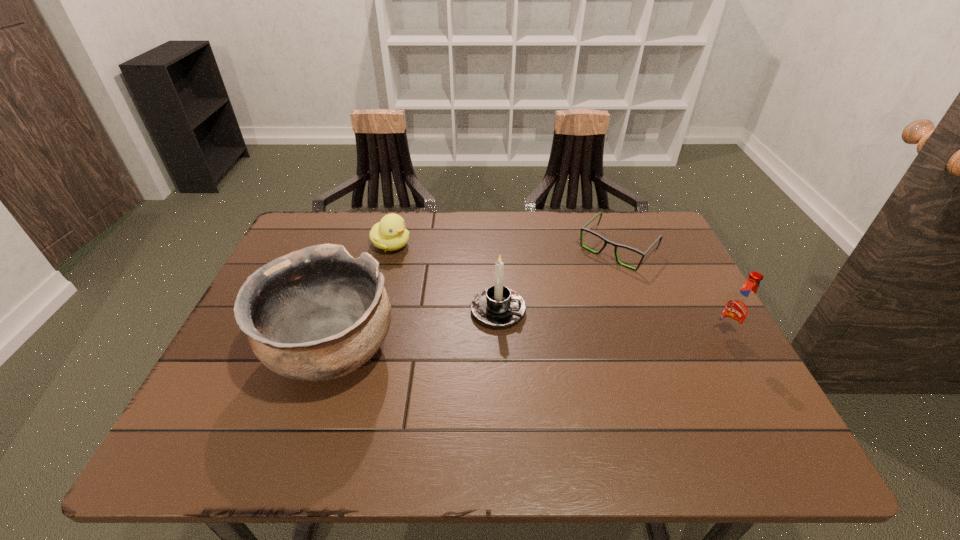
Locate an element on the screen. object present at the left edge is located at coordinates (316, 314).

Where is `root beer positioned at the right edge`? This screenshot has width=960, height=540. root beer positioned at the right edge is located at coordinates (738, 310).

In order to click on spectacles that is at the right edge in this screenshot , I will do `click(583, 228)`.

Locate an element on the screen. The height and width of the screenshot is (540, 960). object that is at the near left corner is located at coordinates (316, 314).

What are the coordinates of `object located at the far right corner` in the screenshot? It's located at (583, 228).

Find the location of a particular element. This screenshot has height=540, width=960. vacant region at the far edge is located at coordinates (591, 222).

Locate an element on the screen. This screenshot has height=540, width=960. free space at the near edge of the desktop is located at coordinates tap(612, 395).

In the image, there is a desktop. At what (x,y) coordinates should I click in order to perform the action: click on vacant space at the right edge. Please return your answer as a coordinate pair (x, y). The height and width of the screenshot is (540, 960). Looking at the image, I should click on (696, 350).

This screenshot has width=960, height=540. What are the coordinates of `vacant space at the far right corner` in the screenshot? It's located at [x=634, y=245].

Find the location of `free spot between the duckling and the fourth object from left to right`. free spot between the duckling and the fourth object from left to right is located at coordinates (504, 247).